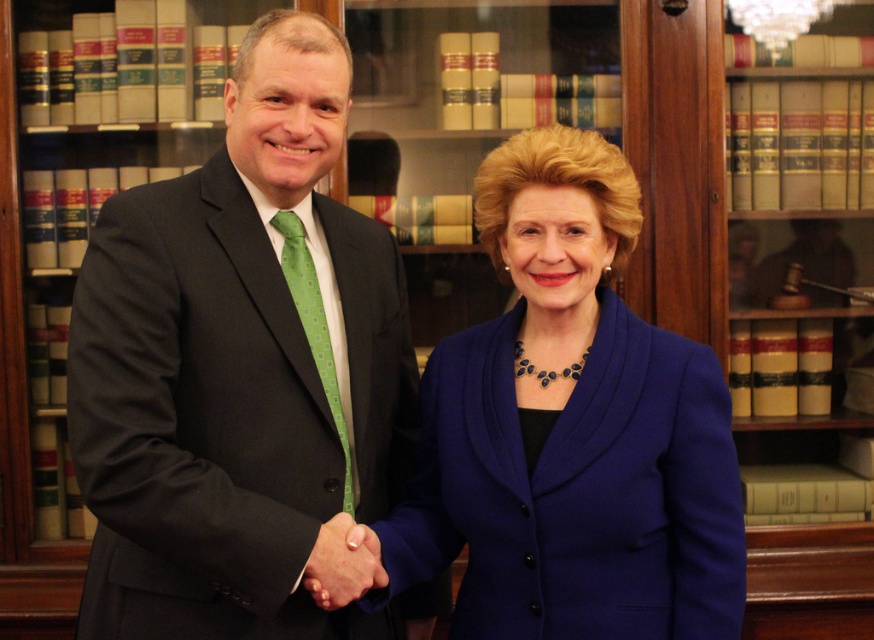
Question: Among these points, which one is nearest to the camera?

Choices:
 (A) (601, 579)
 (B) (321, 355)

Answer: (A)

Question: Does black suit at left have a greater width compared to green dotted tie at center?

Choices:
 (A) yes
 (B) no

Answer: (A)

Question: Among these objects, which one is farthest from the camera?

Choices:
 (A) smooth skin handshake at center
 (B) green dotted tie at center
 (C) black suit at left
 (D) blue fabric jacket at center

Answer: (B)

Question: Among these objects, which one is farthest from the camera?

Choices:
 (A) black suit at left
 (B) blue fabric jacket at center
 (C) smooth skin handshake at center

Answer: (C)

Question: Is black suit at left bigger than smooth skin handshake at center?

Choices:
 (A) no
 (B) yes

Answer: (B)

Question: Where is green dotted tie at center located in relation to smooth skin handshake at center in the image?

Choices:
 (A) left
 (B) right

Answer: (A)